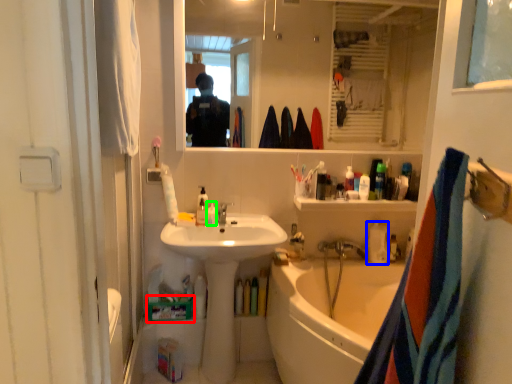
Question: Considering the real-world distances, which object is closest to box (highlighted by a red box)? bottle (highlighted by a blue box) or toiletry (highlighted by a green box).

Choices:
 (A) bottle
 (B) toiletry

Answer: (B)